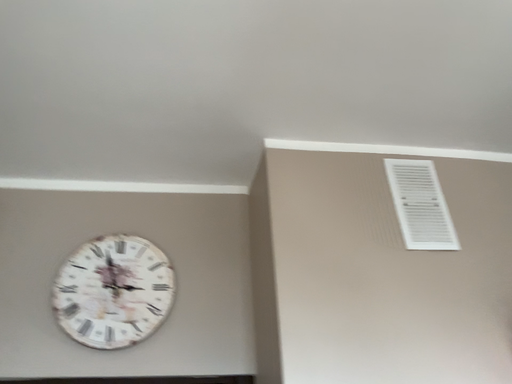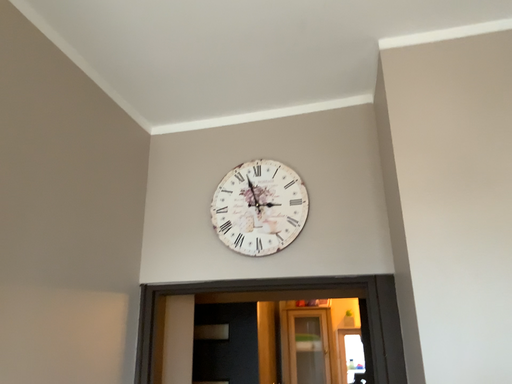
Question: Which way did the camera rotate in the video?

Choices:
 (A) rotated left
 (B) rotated right

Answer: (A)